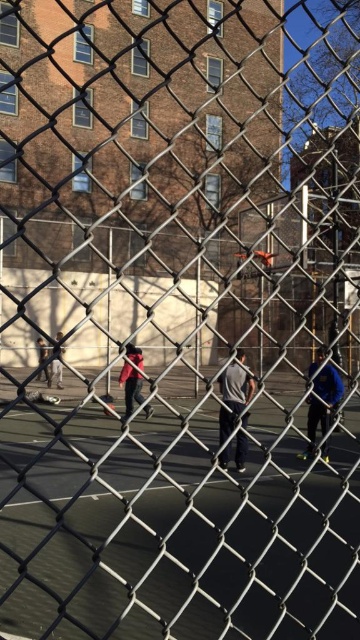
Does red fabric jacket at center have a larger size compared to dark gray hoodie at left?

Actually, red fabric jacket at center might be smaller than dark gray hoodie at left.

The height and width of the screenshot is (640, 360). Identify the location of red fabric jacket at center. (131, 387).

Is blue matte jacket at center shorter than dark blue jacket at center?

Incorrect, blue matte jacket at center's height does not fall short of dark blue jacket at center's.

Between blue matte jacket at center and dark blue jacket at center, which one is positioned lower?

blue matte jacket at center is below.

Identify the location of blue matte jacket at center. (321, 404).

In the scene shown: Which of these two, blue matte jacket at center or dark gray hoodie at left, stands taller?

blue matte jacket at center is taller.

Does point (339, 390) come behind point (47, 356)?

No, it is in front of (47, 356).

The image size is (360, 640). What are the coordinates of `blue matte jacket at center` in the screenshot? It's located at (321, 404).